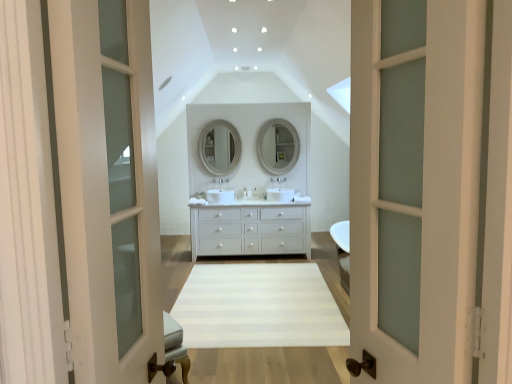
Question: Is white striped rug at center to the left or to the right of white glossy sink at center in the image?

Choices:
 (A) left
 (B) right

Answer: (A)

Question: Would you say white striped rug at center is inside or outside white glossy sink at center?

Choices:
 (A) outside
 (B) inside

Answer: (A)

Question: Estimate the real-world distances between objects in this image. Which object is closer to the matte white mirror at center, which is the 2th mirror from left to right?

Choices:
 (A) white glossy mirror at center, which appears as the first mirror when viewed from the left
 (B) white glossy sink at center
 (C) white striped rug at center
 (D) white frosted glass screen door at left
 (E) matte silver faucet at center, marked as the 2th faucet in a left-to-right arrangement

Answer: (B)

Question: Which object is positioned farthest from the white frosted glass door at center?

Choices:
 (A) white matte chest of drawers at center
 (B) white striped rug at center
 (C) white frosted glass screen door at left
 (D) satin nickel faucet at center, the second faucet when ordered from right to left
 (E) white glossy sink at center

Answer: (D)